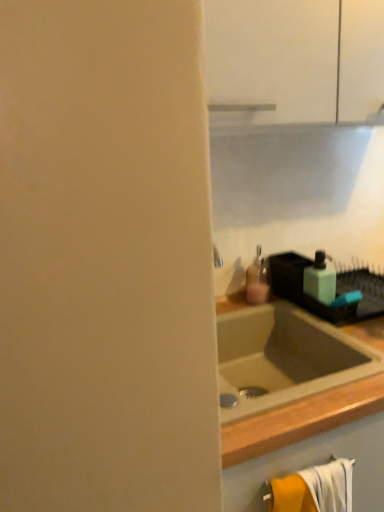
The width and height of the screenshot is (384, 512). What are the coordinates of `free space to the left of green matte soap dispenser at right, which is the 2th soap dispenser in left-to-right order` in the screenshot? It's located at (274, 302).